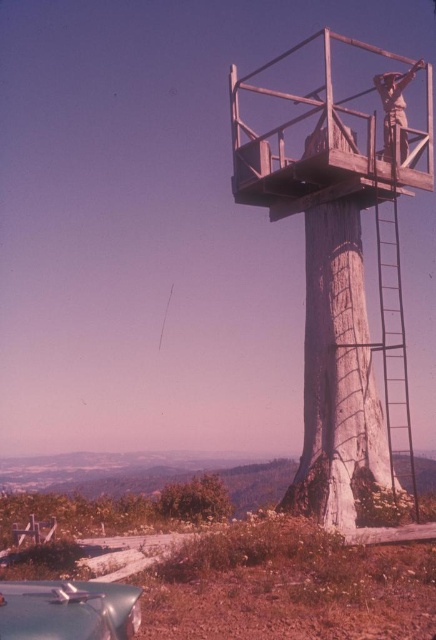
Question: Which of these objects is positioned farthest from the green leafy tree at lower left?

Choices:
 (A) wooden platform at upper center
 (B) rusty metal figure at upper right
 (C) metallic silver lift at upper center
 (D) weathered wood tree trunk at center

Answer: (A)

Question: Which object appears farthest from the camera in this image?

Choices:
 (A) wooden platform at upper center
 (B) rusty metal figure at upper right

Answer: (B)

Question: Can you confirm if shiny metallic car at lower left is positioned below metallic silver lift at upper center?

Choices:
 (A) yes
 (B) no

Answer: (B)

Question: Is wooden platform at upper center below shiny metallic car at lower left?

Choices:
 (A) yes
 (B) no

Answer: (B)

Question: Can you confirm if wooden platform at upper center is bigger than weathered wood tree trunk at center?

Choices:
 (A) no
 (B) yes

Answer: (B)

Question: Among these points, which one is farthest from the camera?

Choices:
 (A) (91, 609)
 (B) (340, 232)

Answer: (B)